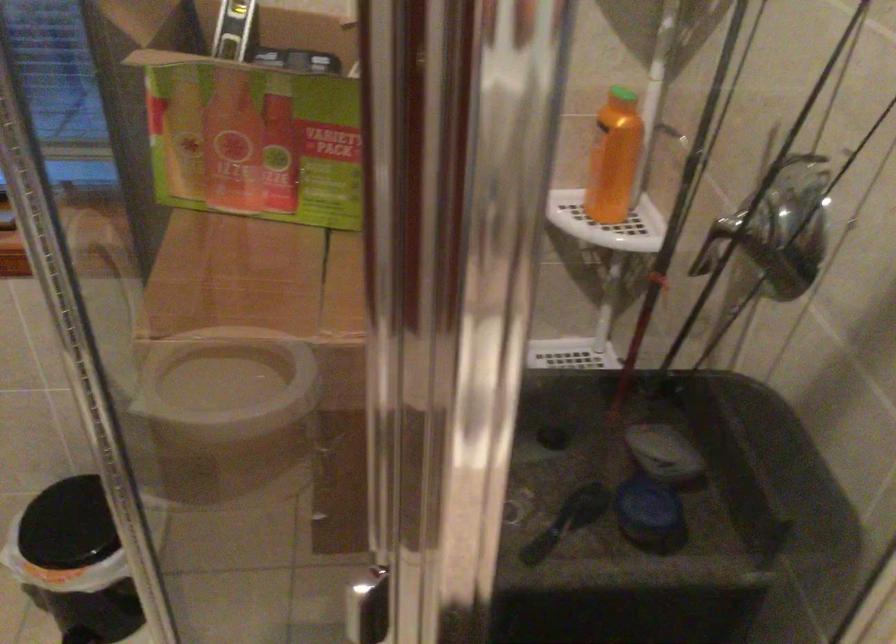
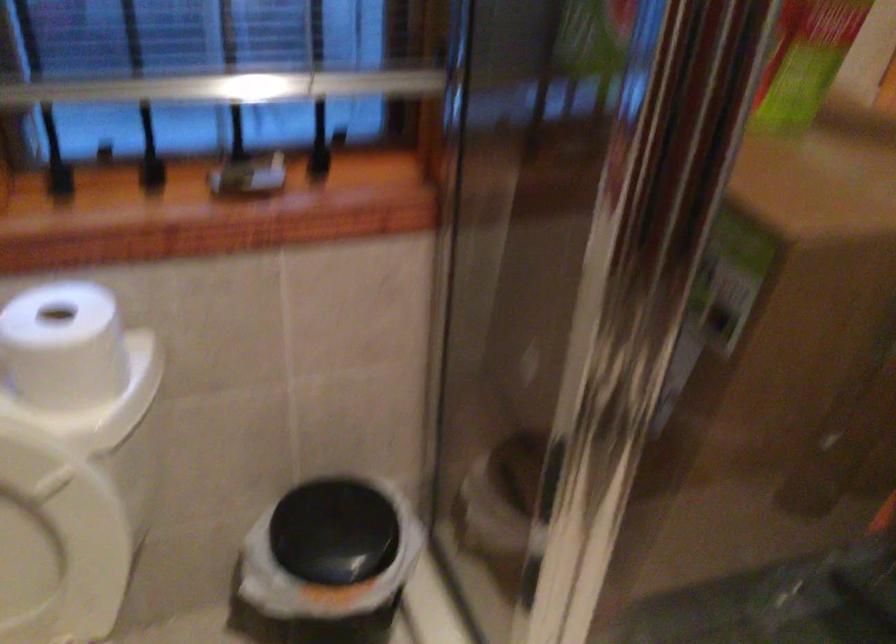
Question: Based on the continuous images, in which direction is the camera rotating? Reply with the corresponding letter.

Choices:
 (A) Left
 (B) Right
 (C) Up
 (D) Down

Answer: (B)